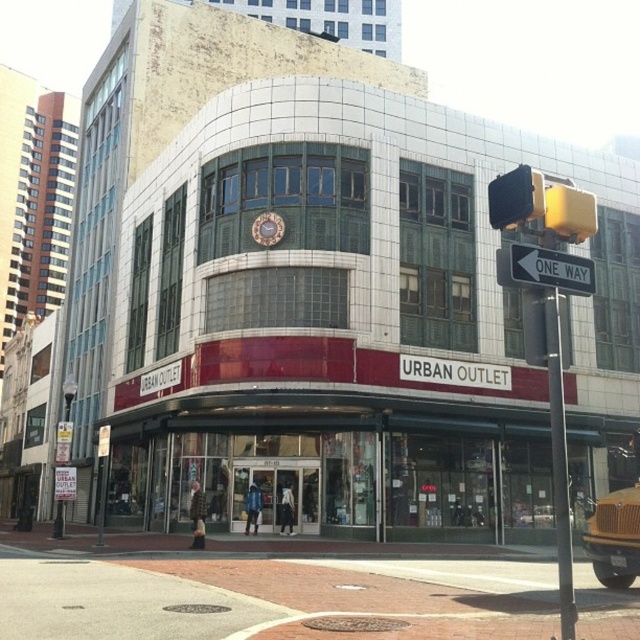
Question: Which of the following is the closest to the observer?

Choices:
 (A) (492, 205)
 (B) (566, 289)
 (C) (604, 516)

Answer: (B)

Question: Is yellow metallic taxi at lower right smaller than white plastic street sign at upper center?

Choices:
 (A) no
 (B) yes

Answer: (A)

Question: In this image, where is yellow plastic traffic light at upper right located relative to yellow metallic taxi at lower right?

Choices:
 (A) right
 (B) left

Answer: (B)

Question: Does matte glass storefront at center appear under yellow plastic traffic light at upper right?

Choices:
 (A) yes
 (B) no

Answer: (A)

Question: Among these objects, which one is nearest to the camera?

Choices:
 (A) yellow metallic taxi at lower right
 (B) matte glass storefront at center

Answer: (A)

Question: Which point is closer to the camera taking this photo?

Choices:
 (A) (605, 534)
 (B) (490, 200)
 (C) (563, 285)

Answer: (C)